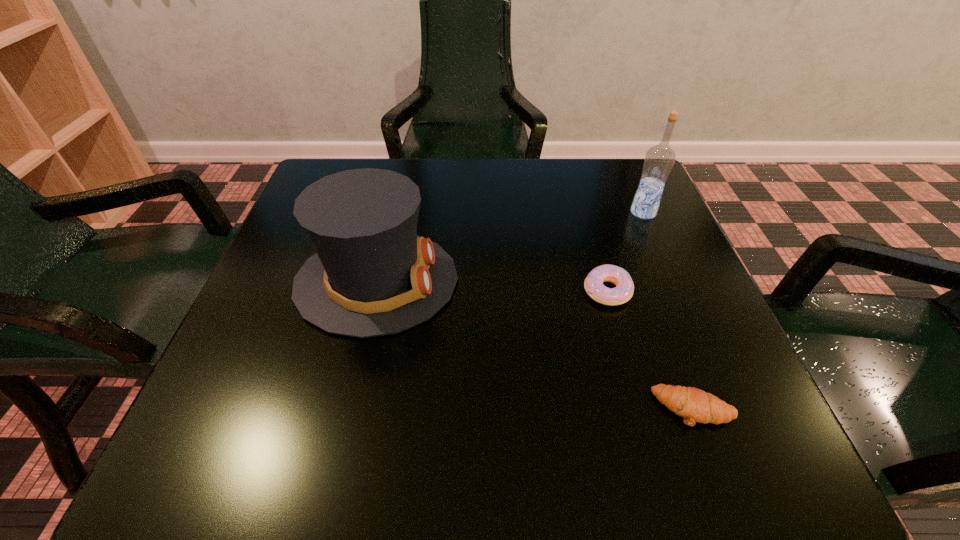
You are a GUI agent. You are given a task and a screenshot of the screen. Output one action in this format:
    pyautogui.click(x=<x>, y=<y>)
    Task: Click on the farthest object
    The height and width of the screenshot is (540, 960).
    Given the screenshot: What is the action you would take?
    pyautogui.click(x=659, y=160)

Where is `the tallest object`? the tallest object is located at coordinates (659, 160).

In order to click on dress hat in this screenshot , I will do `click(372, 275)`.

The image size is (960, 540). What are the coordinates of `the second tallest object` in the screenshot? It's located at (372, 275).

Locate an element on the screen. The image size is (960, 540). doughnut is located at coordinates (593, 284).

Image resolution: width=960 pixels, height=540 pixels. I want to click on the nearest object, so click(x=694, y=405).

I want to click on vacant space situated 0.330m on the front of the tallest object, so click(699, 342).

The image size is (960, 540). I want to click on vacant space located with goggles on the front of the dress hat, so click(611, 281).

The image size is (960, 540). I want to click on free space located 0.400m on the left of the doughnut, so click(369, 291).

The image size is (960, 540). Identify the location of vacant area situated on the back of the crescent roll. (646, 281).